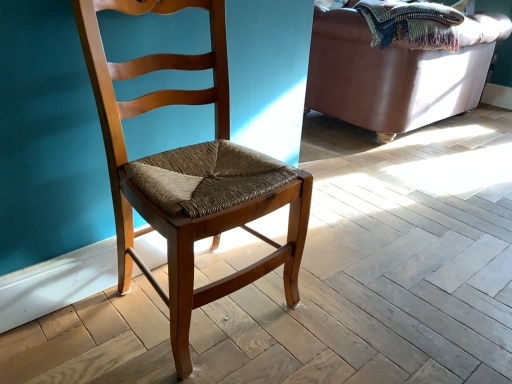
Question: Considering the positions of point (477, 94) and point (110, 86), is point (477, 94) closer or farther from the camera than point (110, 86)?

Choices:
 (A) closer
 (B) farther

Answer: (B)

Question: In terms of width, does leather couch at upper right look wider or thinner when compared to wooden chair at center?

Choices:
 (A) wide
 (B) thin

Answer: (A)

Question: Which is farther from the leather couch at upper right?

Choices:
 (A) woven multicolored blanket at upper right
 (B) wooden chair at center

Answer: (B)

Question: Considering the real-world distances, which object is farthest from the wooden chair at center?

Choices:
 (A) woven multicolored blanket at upper right
 (B) leather couch at upper right

Answer: (B)